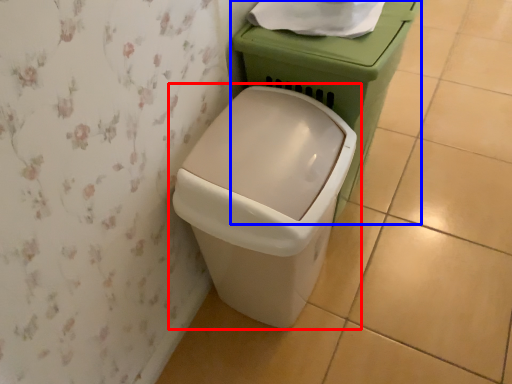
Question: Which point is further to the camera, waste container (highlighted by a red box) or porcelain (highlighted by a blue box)?

Choices:
 (A) waste container
 (B) porcelain

Answer: (B)